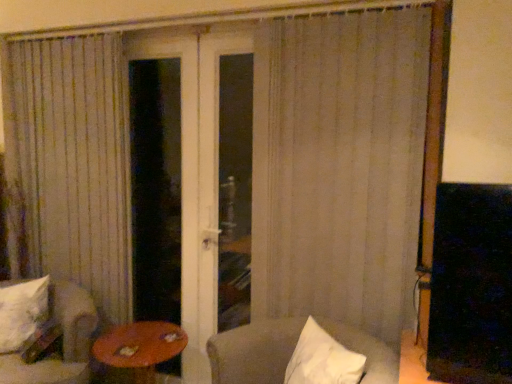
Question: From the image's perspective, is transparent glass door at center on top of white fabric chair at lower left, which is the first chair from left to right?

Choices:
 (A) yes
 (B) no

Answer: (A)

Question: Can you confirm if transparent glass door at center is positioned to the left of white fabric chair at lower left, placed as the 2th chair when sorted from right to left?

Choices:
 (A) no
 (B) yes

Answer: (A)

Question: Does transparent glass door at center have a lesser height compared to white fabric chair at lower left, which is the first chair from left to right?

Choices:
 (A) yes
 (B) no

Answer: (B)

Question: Is transparent glass door at center looking in the opposite direction of white fabric chair at lower left, placed as the 2th chair when sorted from right to left?

Choices:
 (A) no
 (B) yes

Answer: (A)

Question: From a real-world perspective, is transparent glass door at center beneath white fabric chair at lower left, placed as the 2th chair when sorted from right to left?

Choices:
 (A) no
 (B) yes

Answer: (A)

Question: Is the surface of transparent glass door at center in direct contact with white fabric chair at lower left, placed as the 2th chair when sorted from right to left?

Choices:
 (A) yes
 (B) no

Answer: (B)

Question: Does white textured curtain at center appear on the left side of white soft pillow at lower left?

Choices:
 (A) no
 (B) yes

Answer: (A)

Question: Considering the relative sizes of white textured curtain at center and white soft pillow at lower left in the image provided, is white textured curtain at center bigger than white soft pillow at lower left?

Choices:
 (A) yes
 (B) no

Answer: (A)

Question: Is white textured curtain at center looking in the opposite direction of white soft pillow at lower left?

Choices:
 (A) no
 (B) yes

Answer: (A)

Question: Does white textured curtain at center have a greater width compared to white soft pillow at lower left?

Choices:
 (A) no
 (B) yes

Answer: (A)

Question: Can you confirm if white textured curtain at center is thinner than white soft pillow at lower left?

Choices:
 (A) yes
 (B) no

Answer: (A)

Question: From a real-world perspective, is white textured curtain at center physically below white soft pillow at lower left?

Choices:
 (A) no
 (B) yes

Answer: (A)

Question: Is white soft pillow at lower left surrounded by white fabric chair at lower left, placed as the 2th chair when sorted from right to left?

Choices:
 (A) no
 (B) yes

Answer: (B)